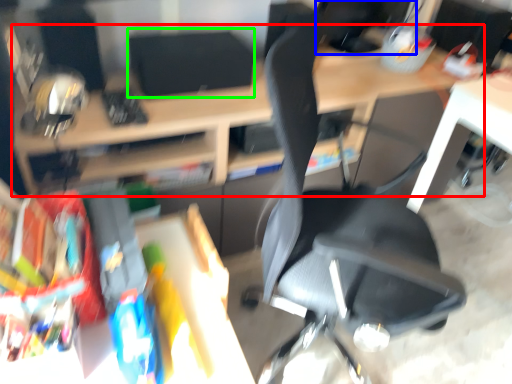
Question: Based on their relative distances, which object is nearer to desk (highlighted by a red box)? Choose from computer monitor (highlighted by a blue box) and computer monitor (highlighted by a green box).

Choices:
 (A) computer monitor
 (B) computer monitor

Answer: (B)